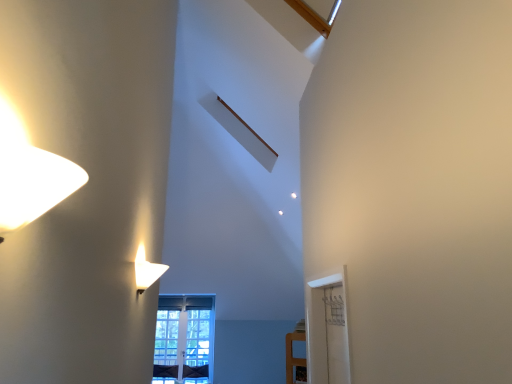
Locate an element on the screen. Image resolution: width=512 pixels, height=384 pixels. clear glass window at center is located at coordinates (184, 338).

This screenshot has width=512, height=384. What do you see at coordinates (184, 338) in the screenshot? I see `clear glass window at center` at bounding box center [184, 338].

What is the approximate width of matte white lampshade at upper left?

matte white lampshade at upper left is 15.38 centimeters in width.

At what (x,y) coordinates should I click in order to perform the action: click on matte white lampshade at upper left. Please return your answer as a coordinate pair (x, y). This screenshot has width=512, height=384. Looking at the image, I should click on (30, 176).

What do you see at coordinates (30, 176) in the screenshot? I see `matte white lampshade at upper left` at bounding box center [30, 176].

Identify the location of clear glass window at center. This screenshot has height=384, width=512. (184, 338).

Looking at this image, considering the positions of objects clear glass window at center and matte white lampshade at upper left in the image provided, who is more to the right, clear glass window at center or matte white lampshade at upper left?

A: matte white lampshade at upper left.

Which object is further away from the camera, clear glass window at center or matte white lampshade at upper left?

Positioned behind is clear glass window at center.

Is point (155, 347) closer or farther from the camera than point (29, 182)?

Point (155, 347) is farther from the camera than point (29, 182).

From the image's perspective, is clear glass window at center located above matte white lampshade at upper left?

No, from the image's perspective, clear glass window at center is not above matte white lampshade at upper left.

From a real-world perspective, is clear glass window at center above or below matte white lampshade at upper left?

From a real-world perspective, clear glass window at center is physically below matte white lampshade at upper left.

Does clear glass window at center have a greater width compared to matte white lampshade at upper left?

Incorrect, the width of clear glass window at center does not surpass that of matte white lampshade at upper left.

Consider the image. Does clear glass window at center have a lesser height compared to matte white lampshade at upper left?

Incorrect, the height of clear glass window at center does not fall short of that of matte white lampshade at upper left.

Considering the sizes of objects clear glass window at center and matte white lampshade at upper left in the image provided, who is bigger, clear glass window at center or matte white lampshade at upper left?

clear glass window at center.

Is matte white lampshade at upper left surrounded by clear glass window at center?

No.

Are clear glass window at center and matte white lampshade at upper left far apart?

That's right, there is a large distance between clear glass window at center and matte white lampshade at upper left.

Looking at this image, does clear glass window at center turn towards matte white lampshade at upper left?

Yes, clear glass window at center is turned towards matte white lampshade at upper left.

Find the location of a particular element. This screenshot has height=384, width=512. window behind the matte white lampshade at upper left is located at coordinates (184, 338).

Would you say matte white lampshade at upper left is to the left or to the right of clear glass window at center in the picture?

matte white lampshade at upper left is to the right of clear glass window at center.

Is matte white lampshade at upper left in front of or behind clear glass window at center in the image?

Clearly, matte white lampshade at upper left is in front of clear glass window at center.

Considering the points (45, 187) and (199, 344), which point is behind, point (45, 187) or point (199, 344)?

The point (199, 344) is more distant.

From the image's perspective, would you say matte white lampshade at upper left is shown under clear glass window at center?

Actually, matte white lampshade at upper left appears above clear glass window at center in the image.

From a real-world perspective, is matte white lampshade at upper left above or below clear glass window at center?

From a real-world perspective, matte white lampshade at upper left is physically above clear glass window at center.

Is matte white lampshade at upper left wider than clear glass window at center?

Correct, the width of matte white lampshade at upper left exceeds that of clear glass window at center.

Does matte white lampshade at upper left have a greater height compared to clear glass window at center?

Incorrect, the height of matte white lampshade at upper left is not larger of that of clear glass window at center.

Can you confirm if matte white lampshade at upper left is smaller than clear glass window at center?

Indeed, matte white lampshade at upper left has a smaller size compared to clear glass window at center.

Is matte white lampshade at upper left situated inside clear glass window at center or outside?

matte white lampshade at upper left is not inside clear glass window at center, it's outside.

Are matte white lampshade at upper left and clear glass window at center beside each other?

No, matte white lampshade at upper left is not with clear glass window at center.

Is matte white lampshade at upper left oriented towards clear glass window at center?

No, matte white lampshade at upper left is not aimed at clear glass window at center.

How many degrees apart are the facing directions of matte white lampshade at upper left and clear glass window at center?

The angular difference between matte white lampshade at upper left and clear glass window at center is 91.1 degrees.

Identify the location of window that appears below the matte white lampshade at upper left (from the image's perspective). The image size is (512, 384). (184, 338).

You are a GUI agent. You are given a task and a screenshot of the screen. Output one action in this format:
    pyautogui.click(x=<x>, y=<y>)
    Task: Click on the window that is behind the matte white lampshade at upper left
    The image size is (512, 384).
    Given the screenshot: What is the action you would take?
    pyautogui.click(x=184, y=338)

This screenshot has height=384, width=512. In order to click on window on the left of matte white lampshade at upper left in this screenshot , I will do `click(184, 338)`.